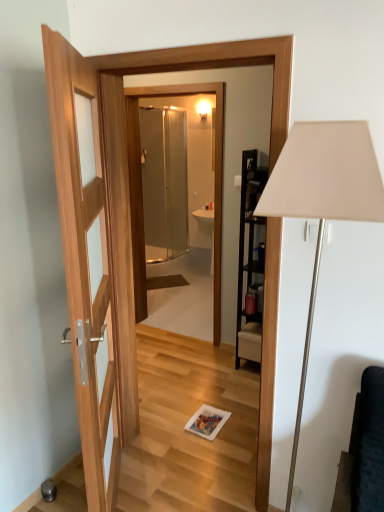
In order to face transparent glass shower at center, should I rotate leftwards or rightwards?

You should look left and rotate roughly 2.781 degrees.

Where is `white matte floor lamp at right`? The height and width of the screenshot is (512, 384). white matte floor lamp at right is located at coordinates (323, 201).

Considering the sizes of objects clear glass shower door at center and white matte floor lamp at right in the image provided, who is taller, clear glass shower door at center or white matte floor lamp at right?

With more height is clear glass shower door at center.

From a real-world perspective, who is located lower, clear glass shower door at center or white matte floor lamp at right?

From a 3D spatial view, white matte floor lamp at right is below.

Considering the sizes of objects clear glass shower door at center and white matte floor lamp at right in the image provided, who is thinner, clear glass shower door at center or white matte floor lamp at right?

With smaller width is white matte floor lamp at right.

Between white matte floor lamp at right and clear glass shower door at center, which one appears on the left side from the viewer's perspective?

Positioned to the left is clear glass shower door at center.

In terms of size, does white matte floor lamp at right appear bigger or smaller than clear glass shower door at center?

Considering their sizes, white matte floor lamp at right takes up less space than clear glass shower door at center.

From the image's perspective, is white matte floor lamp at right located above clear glass shower door at center?

Actually, white matte floor lamp at right appears below clear glass shower door at center in the image.

Could you tell me if white matte floor lamp at right is facing clear glass shower door at center?

No, white matte floor lamp at right is not facing towards clear glass shower door at center.

From the image's perspective, which one is positioned higher, transparent glass shower at center or white matte floor lamp at right?

From the image's view, transparent glass shower at center is above.

From a real-world perspective, is transparent glass shower at center physically above white matte floor lamp at right?

Correct, in the physical world, transparent glass shower at center is higher than white matte floor lamp at right.

Can you tell me how much transparent glass shower at center and white matte floor lamp at right differ in facing direction?

There is a 1.73-degree angle between the facing directions of transparent glass shower at center and white matte floor lamp at right.

Based on their positions, is transparent glass shower at center located to the left or right of white matte floor lamp at right?

transparent glass shower at center is positioned on white matte floor lamp at right's left side.

Is clear glass shower door at center positioned in front of transparent glass shower at center?

No, clear glass shower door at center is behind transparent glass shower at center.

Does clear glass shower door at center appear on the right side of transparent glass shower at center?

In fact, clear glass shower door at center is to the left of transparent glass shower at center.

Which point is more forward, (155,191) or (219,308)?

The point (219,308) is in front.

Choose the correct answer: Is transparent glass shower at center inside clear glass shower door at center or outside it?

transparent glass shower at center exists outside the volume of clear glass shower door at center.

How distant is transparent glass shower at center from clear glass shower door at center?

63.30 centimeters.

From a real-world perspective, is transparent glass shower at center below clear glass shower door at center?

Indeed, from a real-world perspective, transparent glass shower at center is positioned beneath clear glass shower door at center.

Locate an element on the screen. This screenshot has height=512, width=384. mirror directly beneath the clear glass shower door at center (from a real-world perspective) is located at coordinates (215, 173).

What's the angular difference between white matte floor lamp at right and transparent glass shower at center's facing directions?

There is a 1.73-degree angle between the facing directions of white matte floor lamp at right and transparent glass shower at center.

Can you confirm if white matte floor lamp at right is thinner than transparent glass shower at center?

In fact, white matte floor lamp at right might be wider than transparent glass shower at center.

From the image's perspective, is white matte floor lamp at right on top of transparent glass shower at center?

No.

Considering the positions of objects white matte floor lamp at right and transparent glass shower at center in the image provided, who is more to the left, white matte floor lamp at right or transparent glass shower at center?

transparent glass shower at center.

Where is `lamp on the right of clear glass shower door at center`? The image size is (384, 512). lamp on the right of clear glass shower door at center is located at coordinates (323, 201).

Find the location of a particular element. screen door located above the white matte floor lamp at right (from a real-world perspective) is located at coordinates (164, 182).

Considering their positions, is transparent glass shower at center positioned further to clear glass shower door at center than white matte floor lamp at right?

Among the two, white matte floor lamp at right is located further to clear glass shower door at center.

Based on their spatial positions, is transparent glass shower at center or clear glass shower door at center closer to white matte floor lamp at right?

transparent glass shower at center lies closer to white matte floor lamp at right than the other object.

Which object lies nearer to the anchor point transparent glass shower at center, clear glass shower door at center or white matte floor lamp at right?

Based on the image, clear glass shower door at center appears to be nearer to transparent glass shower at center.

Looking at the image, which one is located closer to white matte floor lamp at right, clear glass shower door at center or transparent glass shower at center?

The object closer to white matte floor lamp at right is transparent glass shower at center.

Looking at the image, which one is located further to clear glass shower door at center, white matte floor lamp at right or transparent glass shower at center?

The object further to clear glass shower door at center is white matte floor lamp at right.

When comparing their distances from transparent glass shower at center, does white matte floor lamp at right or clear glass shower door at center seem further?

white matte floor lamp at right is positioned further to the anchor transparent glass shower at center.

Locate an element on the screen. The height and width of the screenshot is (512, 384). mirror between white matte floor lamp at right and clear glass shower door at center along the z-axis is located at coordinates (215, 173).